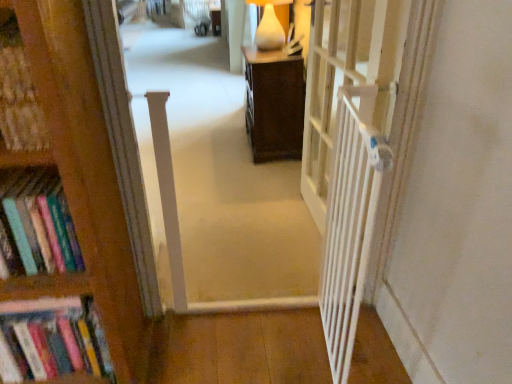
Question: Can you confirm if hardcover books at left is shorter than white plastic gate at right?

Choices:
 (A) no
 (B) yes

Answer: (B)

Question: Is hardcover books at left not within white plastic gate at right?

Choices:
 (A) no
 (B) yes

Answer: (B)

Question: From the image's perspective, is hardcover books at left over white plastic gate at right?

Choices:
 (A) no
 (B) yes

Answer: (A)

Question: Is hardcover books at left turned away from white plastic gate at right?

Choices:
 (A) yes
 (B) no

Answer: (B)

Question: From a real-world perspective, is hardcover books at left over white plastic gate at right?

Choices:
 (A) no
 (B) yes

Answer: (A)

Question: Considering the relative positions of hardcover books at left and white plastic gate at right in the image provided, is hardcover books at left in front of white plastic gate at right?

Choices:
 (A) no
 (B) yes

Answer: (B)

Question: From the image's perspective, is white wooden gate at right above hardcover books at left?

Choices:
 (A) no
 (B) yes

Answer: (B)

Question: Considering the relative sizes of white wooden gate at right and hardcover books at left in the image provided, is white wooden gate at right thinner than hardcover books at left?

Choices:
 (A) yes
 (B) no

Answer: (A)

Question: Considering the relative sizes of white wooden gate at right and hardcover books at left in the image provided, is white wooden gate at right bigger than hardcover books at left?

Choices:
 (A) no
 (B) yes

Answer: (A)

Question: From a real-world perspective, is white wooden gate at right physically below hardcover books at left?

Choices:
 (A) yes
 (B) no

Answer: (B)

Question: Is white wooden gate at right with hardcover books at left?

Choices:
 (A) no
 (B) yes

Answer: (A)

Question: Is the depth of white wooden gate at right greater than that of hardcover books at left?

Choices:
 (A) no
 (B) yes

Answer: (A)

Question: Considering the relative sizes of white wooden gate at right and white plastic gate at right in the image provided, is white wooden gate at right smaller than white plastic gate at right?

Choices:
 (A) no
 (B) yes

Answer: (B)